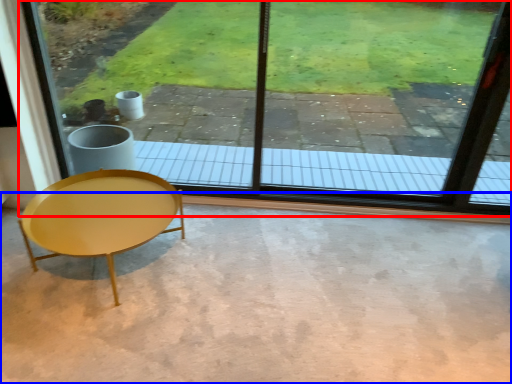
Question: Which point is further to the camera, window (highlighted by a red box) or concrete (highlighted by a blue box)?

Choices:
 (A) window
 (B) concrete

Answer: (A)